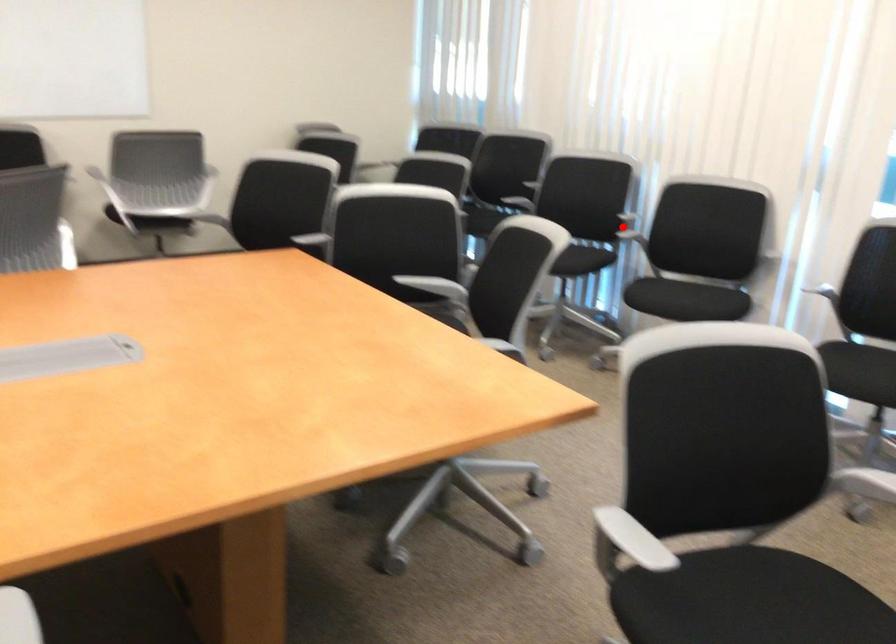
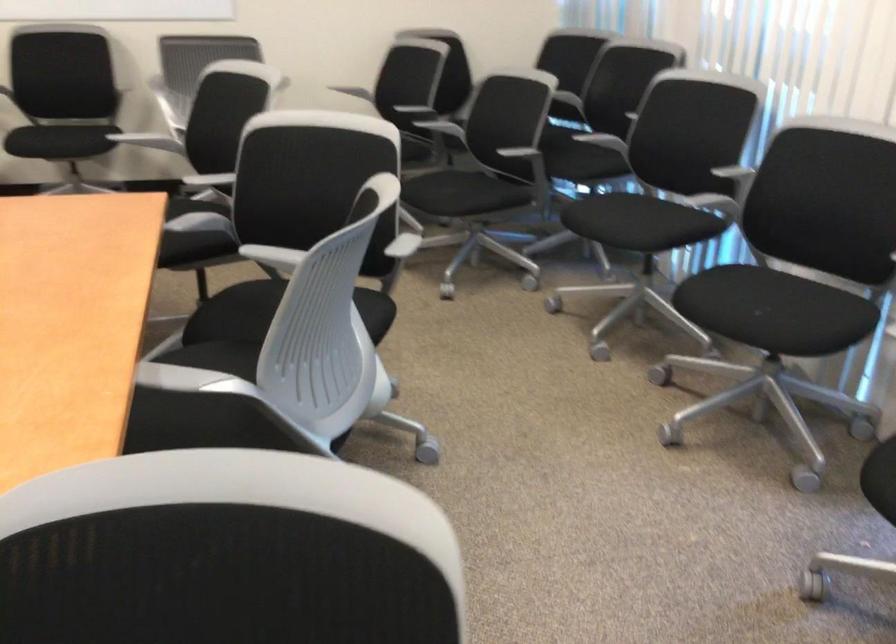
Where in the second image is the point corresponding to the highlighted location from the first image?

(726, 193)